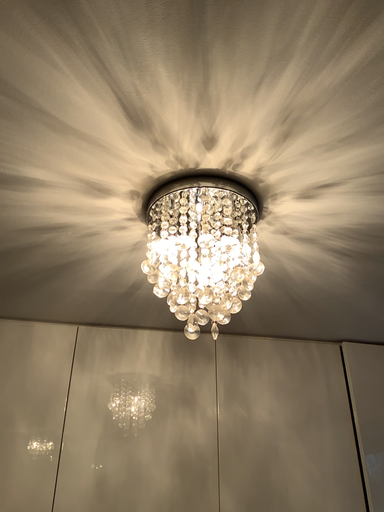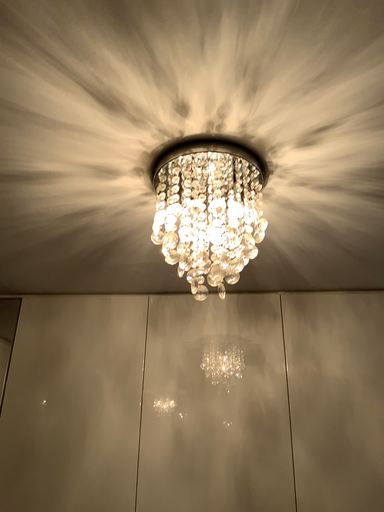
Question: Which way did the camera rotate in the video?

Choices:
 (A) rotated left
 (B) rotated right

Answer: (A)